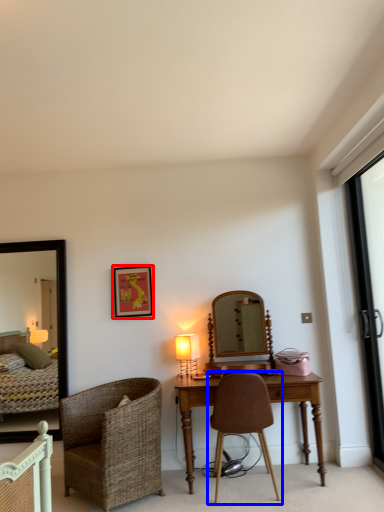
Question: Which object appears closest to the camera in this image, picture frame (highlighted by a red box) or chair (highlighted by a blue box)?

Choices:
 (A) picture frame
 (B) chair

Answer: (B)